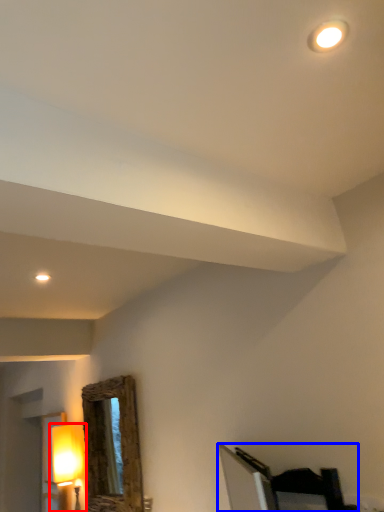
Question: Among these objects, which one is farthest to the camera, lamp (highlighted by a red box) or furniture (highlighted by a blue box)?

Choices:
 (A) lamp
 (B) furniture

Answer: (A)